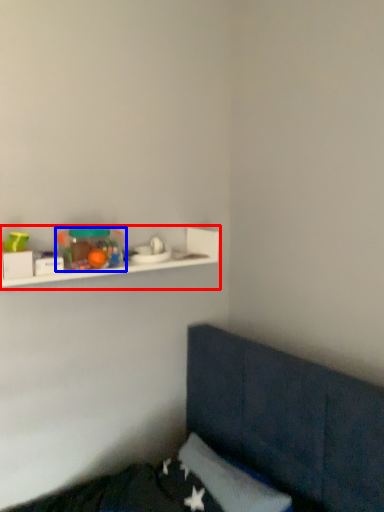
Question: Which of the following is the farthest to the observer, shelf (highlighted by a red box) or toy (highlighted by a blue box)?

Choices:
 (A) shelf
 (B) toy

Answer: (B)